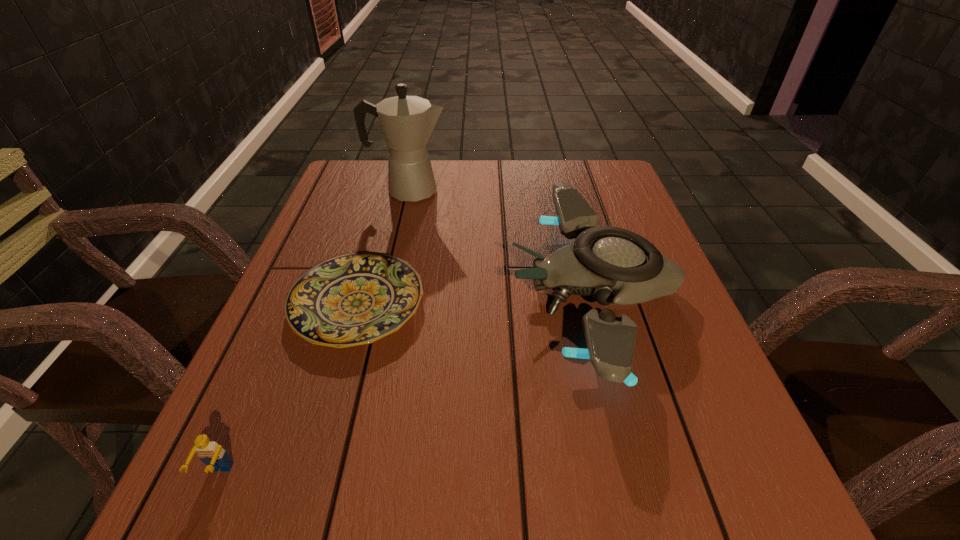
The width and height of the screenshot is (960, 540). Find the location of `the farthest object`. the farthest object is located at coordinates (407, 122).

In order to click on coffeepot in this screenshot , I will do `click(407, 122)`.

Image resolution: width=960 pixels, height=540 pixels. I want to click on the rightmost object, so [614, 265].

Where is `the third shortest object`? This screenshot has width=960, height=540. the third shortest object is located at coordinates (614, 265).

Identify the location of the nearest object. (212, 454).

The height and width of the screenshot is (540, 960). I want to click on the second shortest object, so click(x=212, y=454).

Find the location of a particular element. The width and height of the screenshot is (960, 540). plate is located at coordinates tap(353, 299).

This screenshot has width=960, height=540. In order to click on vacant space situated 0.240m on the right of the tallest object in this screenshot , I will do `click(537, 191)`.

Where is `vacant space situated on the front-facing side of the third shortest object`? The height and width of the screenshot is (540, 960). vacant space situated on the front-facing side of the third shortest object is located at coordinates (x=327, y=290).

Find the location of a particular element. Image resolution: width=960 pixels, height=540 pixels. free region located on the front-facing side of the third shortest object is located at coordinates (448, 290).